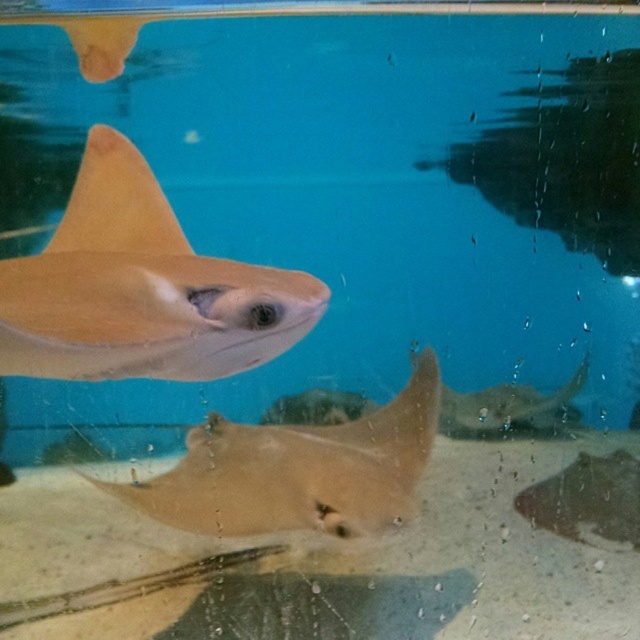
Is light brown matte stingray at center to the right of light tan smooth fin at upper left from the viewer's perspective?

Indeed, light brown matte stingray at center is positioned on the right side of light tan smooth fin at upper left.

Can you confirm if light brown matte stingray at center is bigger than light tan smooth fin at upper left?

Yes.

Does point (232, 476) lie behind point (112, 208)?

That is True.

Locate an element on the screen. The height and width of the screenshot is (640, 640). light brown matte stingray at center is located at coordinates (298, 470).

Who is positioned more to the left, light brown matte stingray at upper left or light brown matte stingray at center?

light brown matte stingray at upper left

Measure the distance between point (x=99, y=220) and camera.

Point (x=99, y=220) and camera are 5.07 feet apart.

This screenshot has height=640, width=640. I want to click on light brown matte stingray at upper left, so click(140, 289).

Who is positioned more to the right, light brown matte stingray at upper left or light tan smooth fin at upper left?

light brown matte stingray at upper left

Is light brown matte stingray at upper left positioned at the back of light tan smooth fin at upper left?

No, light brown matte stingray at upper left is closer to the viewer.

At what (x,y) coordinates should I click in order to perform the action: click on light brown matte stingray at upper left. Please return your answer as a coordinate pair (x, y). Looking at the image, I should click on tap(140, 289).